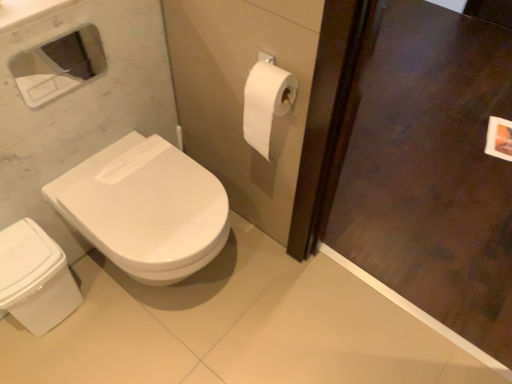
Question: Is dark wood screen door at right not within white glossy toilet at lower left?

Choices:
 (A) yes
 (B) no

Answer: (A)

Question: Considering the relative sizes of dark wood screen door at right and white glossy toilet at lower left in the image provided, is dark wood screen door at right bigger than white glossy toilet at lower left?

Choices:
 (A) no
 (B) yes

Answer: (B)

Question: Is dark wood screen door at right far away from white glossy toilet at lower left?

Choices:
 (A) no
 (B) yes

Answer: (B)

Question: From the image's perspective, is dark wood screen door at right above white glossy toilet at lower left?

Choices:
 (A) no
 (B) yes

Answer: (B)

Question: Considering the relative sizes of dark wood screen door at right and white glossy toilet at lower left in the image provided, is dark wood screen door at right smaller than white glossy toilet at lower left?

Choices:
 (A) no
 (B) yes

Answer: (A)

Question: Visually, is white glossy toilet at lower left positioned to the left or to the right of white glossy bidet at lower left?

Choices:
 (A) left
 (B) right

Answer: (B)

Question: Considering the positions of white glossy toilet at lower left and white glossy bidet at lower left in the image, is white glossy toilet at lower left taller or shorter than white glossy bidet at lower left?

Choices:
 (A) tall
 (B) short

Answer: (A)

Question: Considering the positions of white glossy toilet at lower left and white glossy bidet at lower left in the image, is white glossy toilet at lower left wider or thinner than white glossy bidet at lower left?

Choices:
 (A) wide
 (B) thin

Answer: (A)

Question: Considering the positions of point tap(203, 187) and point tap(31, 236), is point tap(203, 187) closer or farther from the camera than point tap(31, 236)?

Choices:
 (A) farther
 (B) closer

Answer: (A)

Question: In terms of width, does white glossy medicine cabinet at upper left look wider or thinner when compared to dark wood screen door at right?

Choices:
 (A) wide
 (B) thin

Answer: (B)

Question: Is white glossy medicine cabinet at upper left taller or shorter than dark wood screen door at right?

Choices:
 (A) tall
 (B) short

Answer: (B)

Question: From the image's perspective, is white glossy medicine cabinet at upper left positioned above or below dark wood screen door at right?

Choices:
 (A) below
 (B) above

Answer: (B)

Question: Considering their positions, is white glossy medicine cabinet at upper left located in front of or behind dark wood screen door at right?

Choices:
 (A) front
 (B) behind

Answer: (B)

Question: Is white glossy bidet at lower left taller or shorter than white glossy medicine cabinet at upper left?

Choices:
 (A) short
 (B) tall

Answer: (B)

Question: Is white glossy bidet at lower left situated inside white glossy medicine cabinet at upper left or outside?

Choices:
 (A) outside
 (B) inside

Answer: (A)